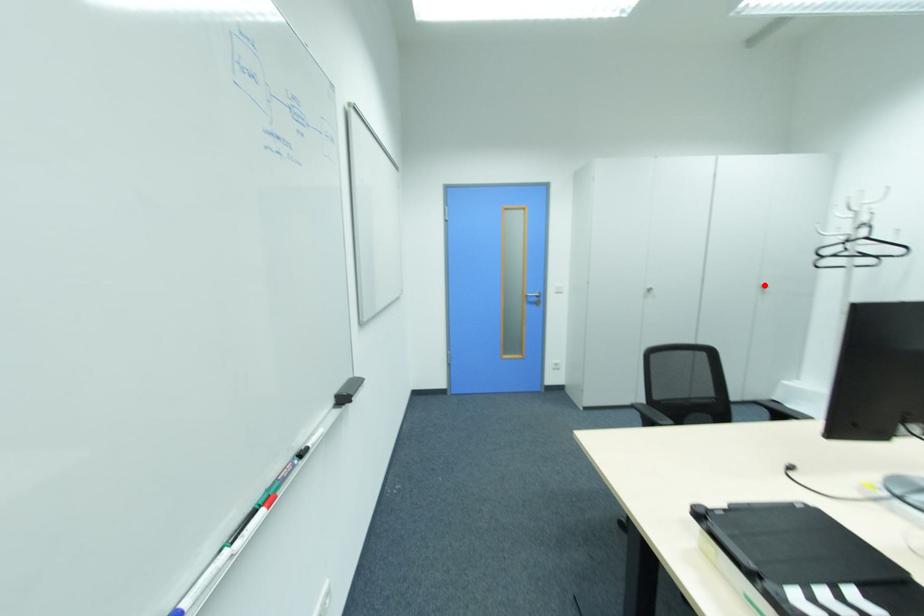
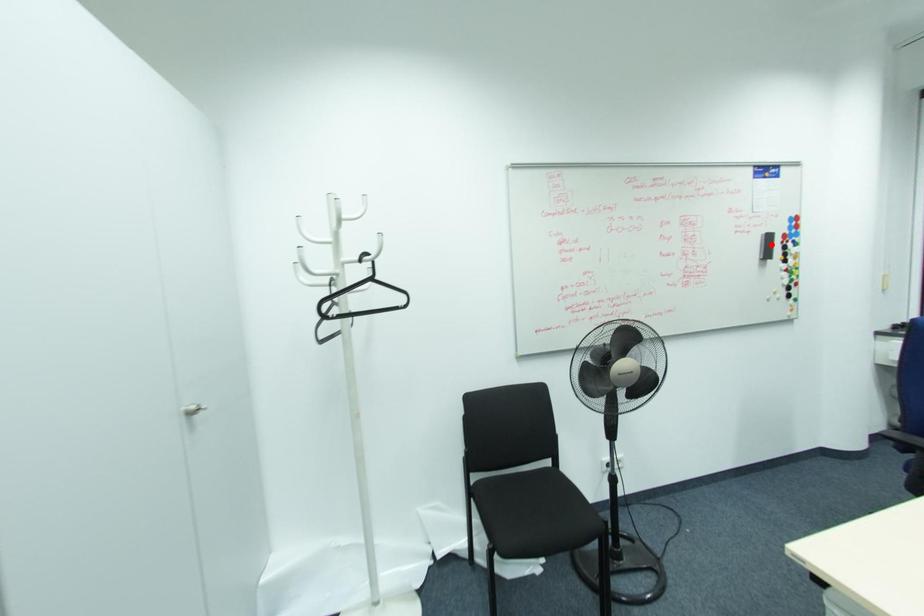
I am providing you with two images of the same scene from different viewpoints. A red point is marked on the first image and another point is marked on the second image. Does the point marked in image1 correspond to the same location as the one in image2?

No